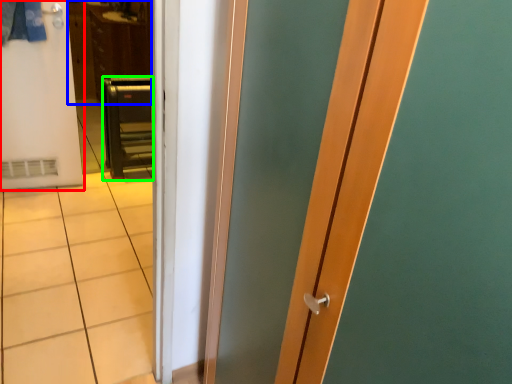
Question: Based on their relative distances, which object is nearer to door (highlighted by a red box)? Choose from dresser (highlighted by a blue box) and furniture (highlighted by a green box).

Choices:
 (A) dresser
 (B) furniture

Answer: (B)